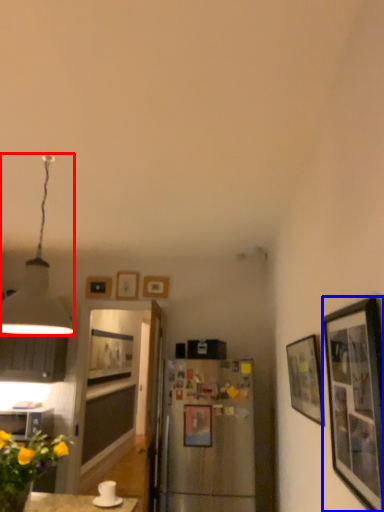
Question: Which point is further to the camera, lamp (highlighted by a red box) or picture frame (highlighted by a blue box)?

Choices:
 (A) lamp
 (B) picture frame

Answer: (A)